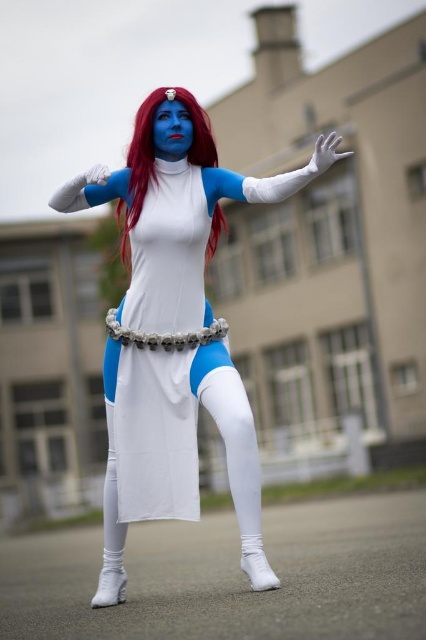
Question: Which point is farther to the camera?

Choices:
 (A) (236, 468)
 (B) (68, 198)
 (C) (141, 128)

Answer: (C)

Question: Where is matte white costume at center located in relation to shiny red hair at center in the image?

Choices:
 (A) below
 (B) above

Answer: (A)

Question: Among these objects, which one is farthest from the camera?

Choices:
 (A) matte white glove at upper center
 (B) shiny red hair at center
 (C) white matte leggings at lower center
 (D) white matte glove at upper center

Answer: (B)

Question: Which of the following is the farthest from the observer?

Choices:
 (A) matte white glove at upper center
 (B) white matte leggings at lower center
 (C) matte white costume at center

Answer: (A)

Question: Is white matte leggings at lower center smaller than white matte glove at upper center?

Choices:
 (A) no
 (B) yes

Answer: (B)

Question: Is the position of white matte leggings at lower center more distant than that of white matte glove at upper center?

Choices:
 (A) yes
 (B) no

Answer: (A)